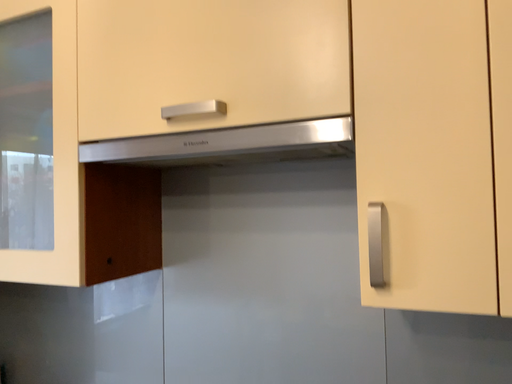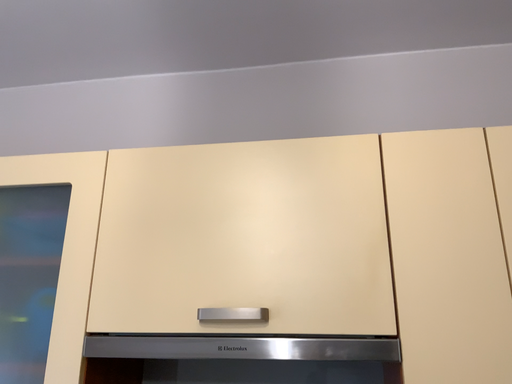
Question: Which way did the camera rotate in the video?

Choices:
 (A) rotated downward
 (B) rotated upward

Answer: (B)